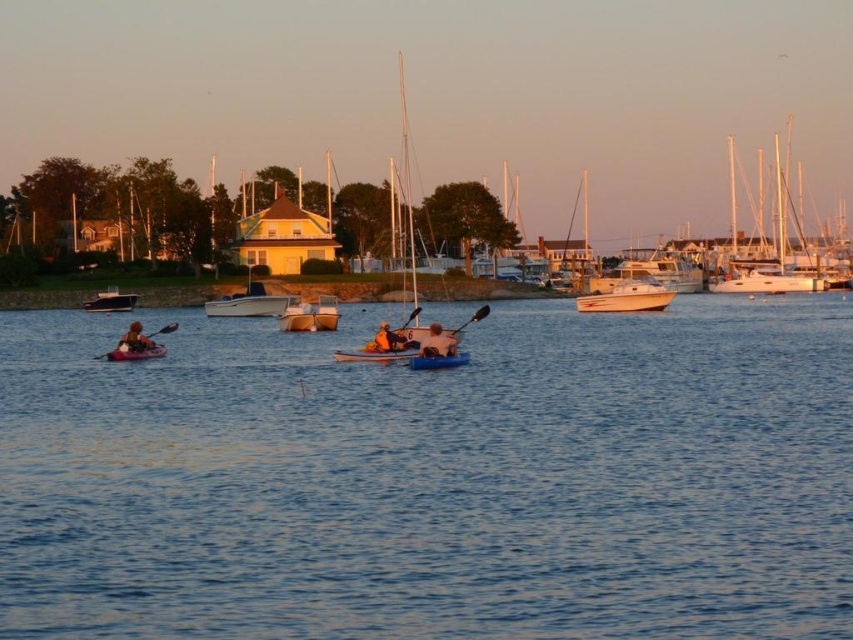
Question: Which of the following is the closest to the observer?

Choices:
 (A) matte pink kayak at left
 (B) wooden canoe at center
 (C) blue plastic canoe at center
 (D) orange fabric kayak at center

Answer: (C)

Question: Which point is closer to the camera?

Choices:
 (A) (436, 336)
 (B) (399, 352)
 (C) (161, 349)
 (D) (378, 339)

Answer: (A)

Question: Which point is farther to the camera?

Choices:
 (A) (344, 352)
 (B) (91, 301)
 (C) (186, 497)
 (D) (432, 348)

Answer: (B)

Question: Observing the image, what is the correct spatial positioning of blue plastic canoe at center in reference to matte pink kayak at left?

Choices:
 (A) left
 (B) right

Answer: (B)

Question: Can you confirm if wooden canoe at center is wider than smooth blue kayak at center?

Choices:
 (A) no
 (B) yes

Answer: (B)

Question: Is matte pink kayak at left closer to camera compared to orange fabric kayak at center?

Choices:
 (A) yes
 (B) no

Answer: (B)